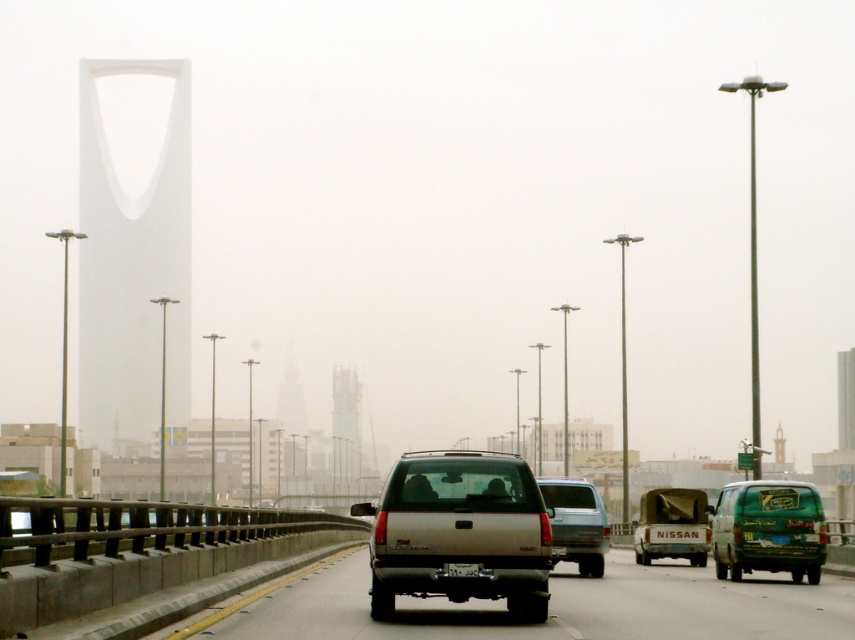
Question: Is silver metallic truck at center thinner than matte silver suv at center?

Choices:
 (A) no
 (B) yes

Answer: (A)

Question: Which of the following is the closest to the observer?

Choices:
 (A) matte silver truck at center
 (B) matte silver suv at center
 (C) black plastic license plate at center

Answer: (C)

Question: Which object appears farthest from the camera in this image?

Choices:
 (A) matte silver truck at center
 (B) matte silver suv at center

Answer: (A)

Question: Among these objects, which one is farthest from the camera?

Choices:
 (A) silver metallic truck at center
 (B) matte silver suv at center
 (C) matte silver truck at center
 (D) black plastic license plate at center

Answer: (C)

Question: Can you confirm if silver metallic truck at center is thinner than satin silver suv at center?

Choices:
 (A) no
 (B) yes

Answer: (A)

Question: Is matte silver truck at center further to the viewer compared to black plastic license plate at center?

Choices:
 (A) yes
 (B) no

Answer: (A)